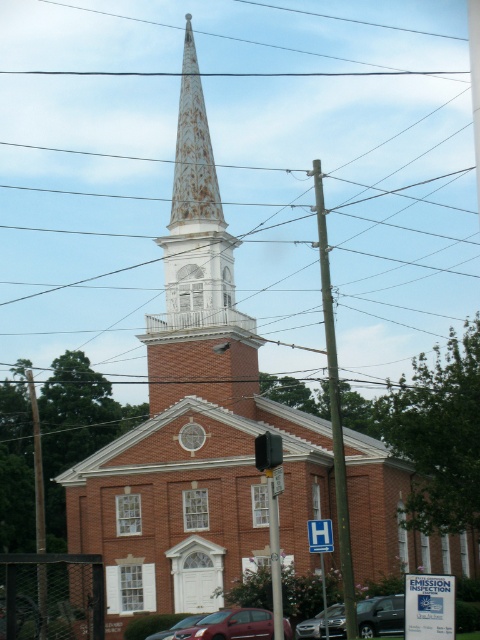
Question: Which point is farther from the camera taking this photo?

Choices:
 (A) (271, 452)
 (B) (195, 115)
 (C) (147, 636)

Answer: (B)

Question: Can you confirm if clear plastic power line at upper center is bigger than metallic pole at center?

Choices:
 (A) no
 (B) yes

Answer: (B)

Question: Can you confirm if brown wooden utility pole at center is positioned above metallic rectangular traffic light at center?

Choices:
 (A) yes
 (B) no

Answer: (A)

Question: Can you confirm if white textured steeple at center is wider than metallic red car at center?

Choices:
 (A) yes
 (B) no

Answer: (A)

Question: Which point is closer to the camera taking this photo?

Choices:
 (A) (339, 611)
 (B) (192, 243)

Answer: (A)

Question: Which object is farther from the camera taking this photo?

Choices:
 (A) metallic silver sedan at center
 (B) metallic pole at center

Answer: (A)